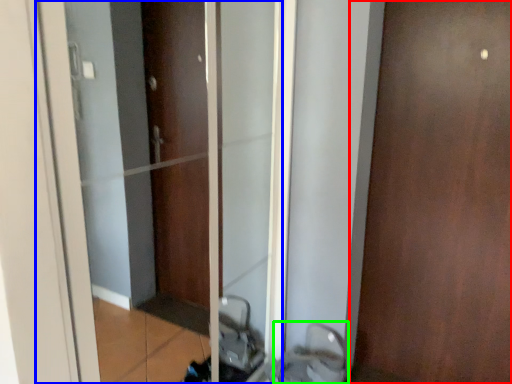
Question: Which object is positioned farthest from door (highlighted by a red box)? Select from elevator (highlighted by a blue box) and sink (highlighted by a green box).

Choices:
 (A) elevator
 (B) sink

Answer: (A)